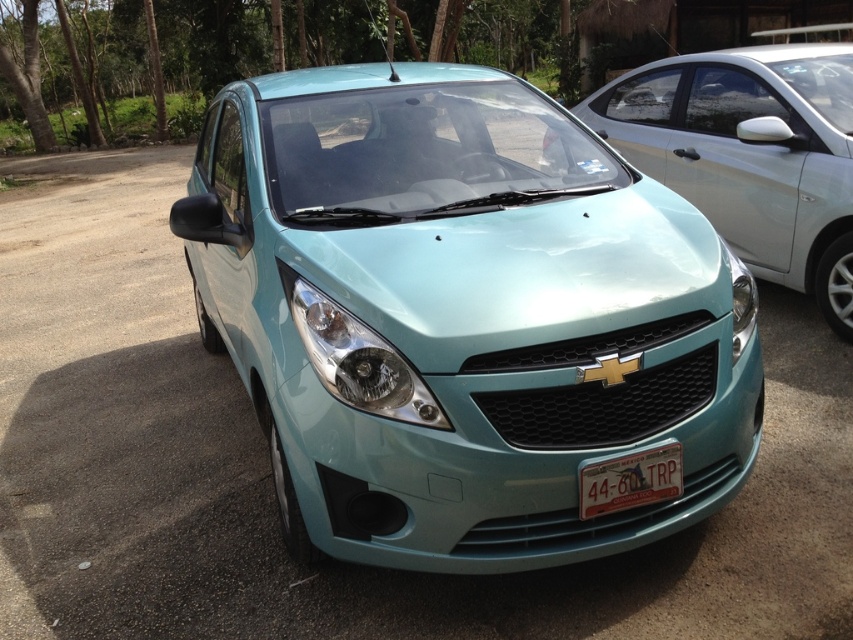
You are a mechanic inspecting the satin teal headlight at center and the white plastic license plate at center of the Chevrolet Spark. From the driver seat, which object would you see first when looking straight ahead?

The satin teal headlight at center is in front of the white plastic license plate at center, so you would see the satin teal headlight at center first when looking straight ahead from the driver seat.

You are a photographer trying to capture the license plate details of the light blue glossy car at center. However, the white plastic license plate at center is partially obscured by the car itself. Can you still get a clear photo of the license plate?

The light blue glossy car at center is much taller than the white plastic license plate at center, so the license plate is likely positioned lower on the car and may not be fully obscured by the car itself. You should be able to capture a clear photo of the license plate.